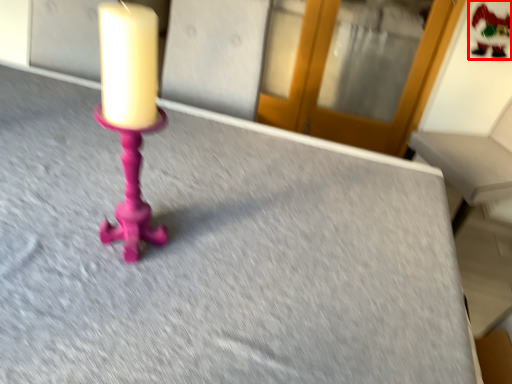
Question: From the image's perspective, considering the relative positions of santa claus (annotated by the red box) and glass door in the image provided, where is santa claus (annotated by the red box) located with respect to the staircase?

Choices:
 (A) below
 (B) above

Answer: (A)